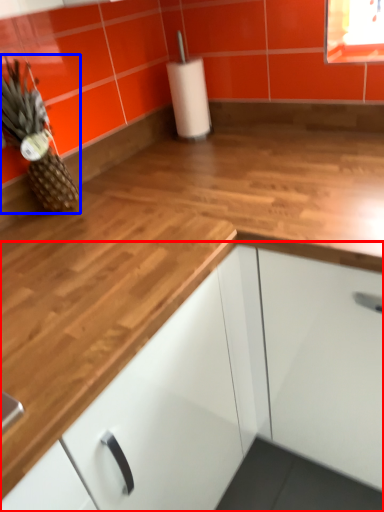
Question: Which object appears closest to the camera in this image, cabinetry (highlighted by a red box) or pineapple (highlighted by a blue box)?

Choices:
 (A) cabinetry
 (B) pineapple

Answer: (A)